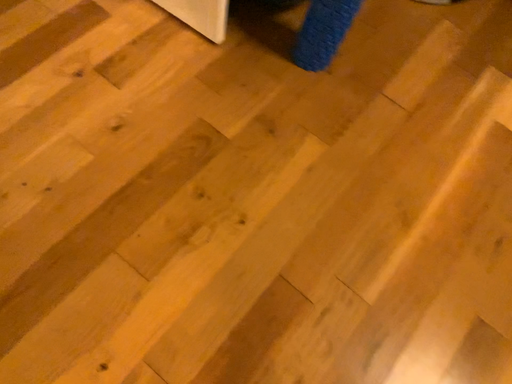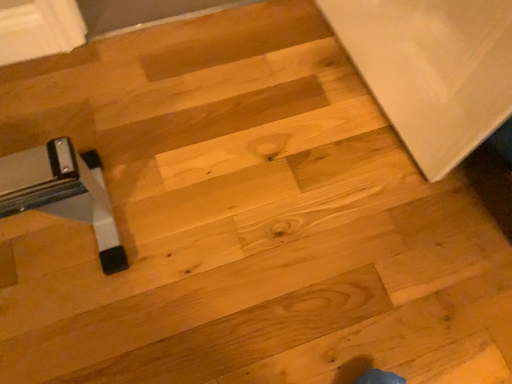
Question: Which way did the camera rotate in the video?

Choices:
 (A) rotated left
 (B) rotated right

Answer: (A)